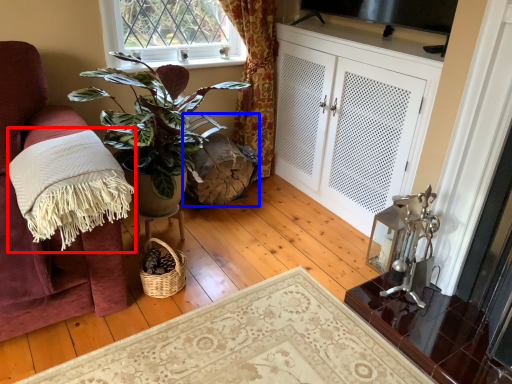
Question: Among these objects, which one is nearest to the camera, blanket (highlighted by a red box) or swivel chair (highlighted by a blue box)?

Choices:
 (A) blanket
 (B) swivel chair

Answer: (A)